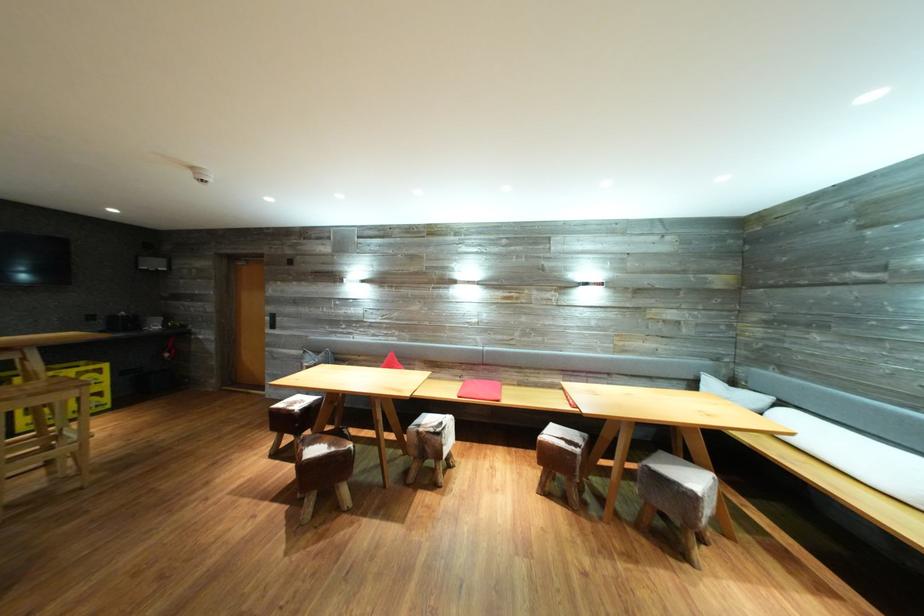
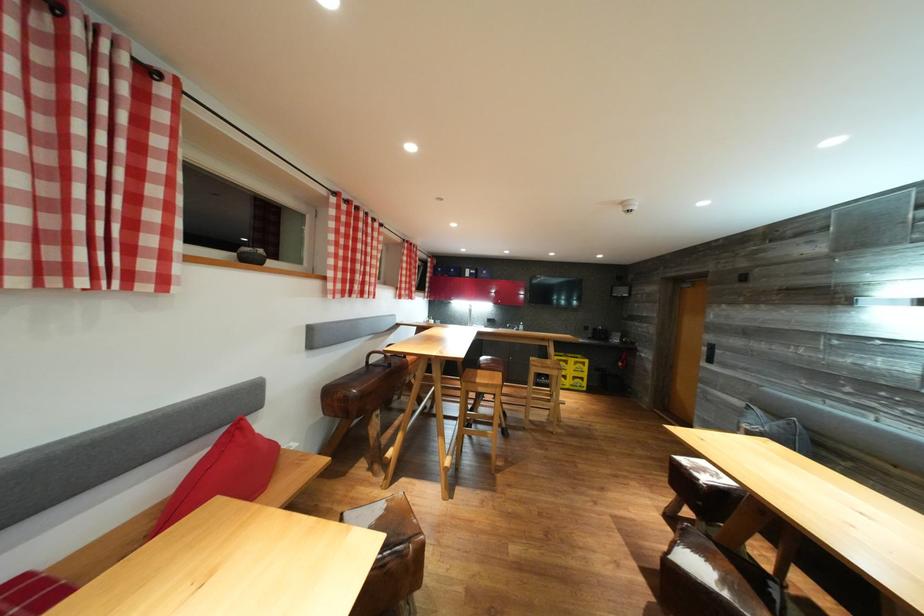
Find the pixel in the second image that matches (x=286, y=411) in the first image.

(689, 466)